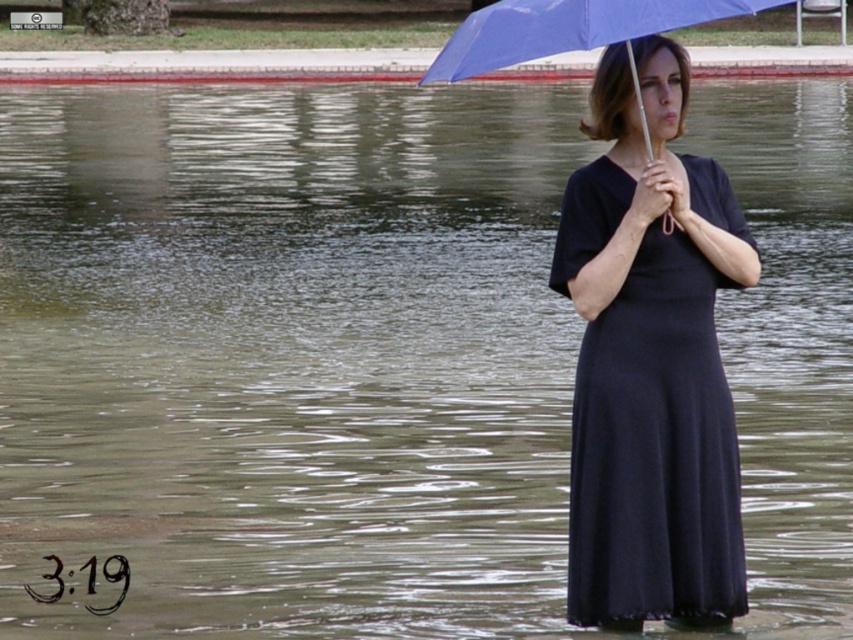
Question: Is black matte dress at center above blue matte umbrella at upper center?

Choices:
 (A) no
 (B) yes

Answer: (A)

Question: Is black matte dress at center to the left of blue matte umbrella at upper center from the viewer's perspective?

Choices:
 (A) yes
 (B) no

Answer: (B)

Question: Which point is farther from the camera taking this photo?

Choices:
 (A) (502, 38)
 (B) (740, 577)

Answer: (B)

Question: Is black matte dress at center smaller than blue matte umbrella at upper center?

Choices:
 (A) yes
 (B) no

Answer: (A)